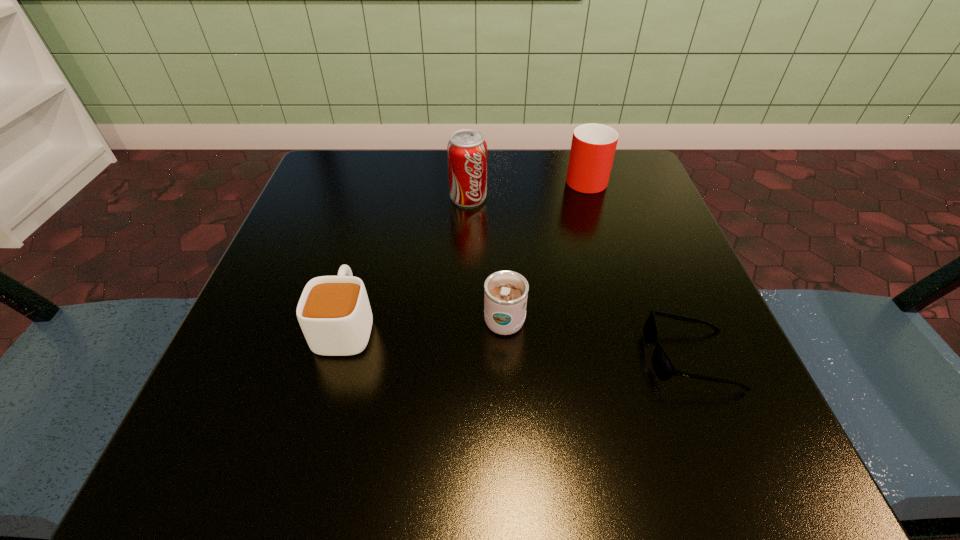
The width and height of the screenshot is (960, 540). Find the location of `vacant space in between the leftmost object and the second cup from right to left`. vacant space in between the leftmost object and the second cup from right to left is located at coordinates (425, 321).

Locate an element on the screen. unoccupied area between the leftmost object and the farthest cup is located at coordinates (466, 251).

At what (x,y) coordinates should I click in order to perform the action: click on vacant space that is in between the leftmost cup and the second cup from left to right. Please return your answer as a coordinate pair (x, y). This screenshot has width=960, height=540. Looking at the image, I should click on (425, 321).

Where is `free space between the farthest cup and the leftmost cup`? free space between the farthest cup and the leftmost cup is located at coordinates (466, 251).

At what (x,y) coordinates should I click in order to perform the action: click on empty space between the second cup from left to right and the soda can. Please return your answer as a coordinate pair (x, y). Looking at the image, I should click on pos(486,258).

You are a GUI agent. You are given a task and a screenshot of the screen. Output one action in this format:
    pyautogui.click(x=<x>, y=<y>)
    Task: Click on the free space between the leftmost object and the farthest cup
    The width and height of the screenshot is (960, 540).
    Given the screenshot: What is the action you would take?
    pyautogui.click(x=466, y=251)

Identify the location of empty location between the second cup from left to right and the leftmost object. This screenshot has width=960, height=540. (425, 321).

You are a GUI agent. You are given a task and a screenshot of the screen. Output one action in this format:
    pyautogui.click(x=<x>, y=<y>)
    Task: Click on the vacant area that lies between the second cup from right to left and the shortest object
    The image size is (960, 540).
    Given the screenshot: What is the action you would take?
    pyautogui.click(x=597, y=338)

Locate an element on the screen. vacant point located between the second shortest object and the rightmost cup is located at coordinates (466, 251).

You are a GUI agent. You are given a task and a screenshot of the screen. Output one action in this format:
    pyautogui.click(x=<x>, y=<y>)
    Task: Click on the closest object relative to the tallest object
    
    Given the screenshot: What is the action you would take?
    pyautogui.click(x=593, y=147)